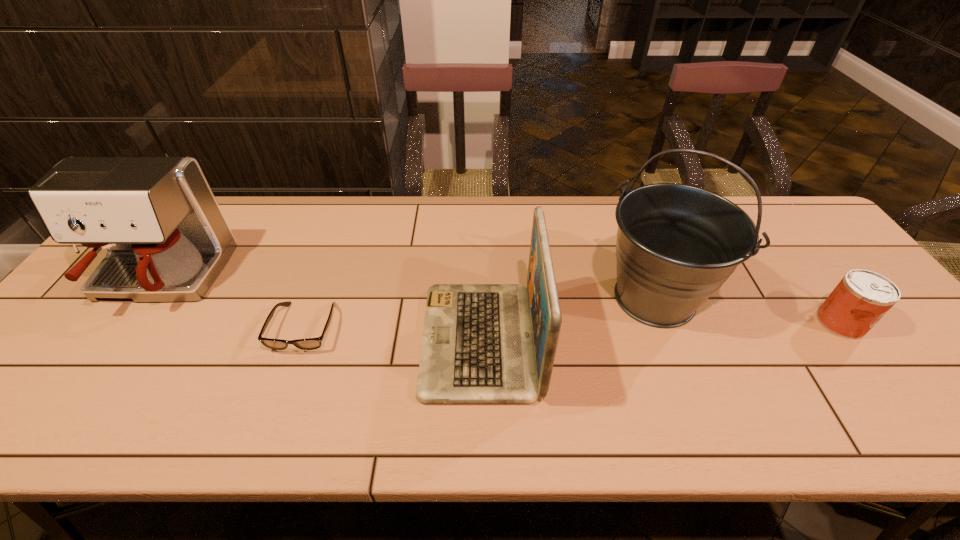
Where is `vacant space at the left edge of the desktop`? The height and width of the screenshot is (540, 960). vacant space at the left edge of the desktop is located at coordinates (84, 330).

Image resolution: width=960 pixels, height=540 pixels. I want to click on vacant space at the right edge of the desktop, so click(824, 251).

You are a GUI agent. You are given a task and a screenshot of the screen. Output one action in this format:
    pyautogui.click(x=<x>, y=<y>)
    Task: Click on the free space at the far right corner of the desktop
    This screenshot has width=960, height=540.
    Given the screenshot: What is the action you would take?
    pyautogui.click(x=756, y=198)

Identify the location of empty space that is in between the tallest object and the leftmost object. This screenshot has width=960, height=540. (407, 288).

Locate an element on the screen. The height and width of the screenshot is (540, 960). vacant region between the tallest object and the leftmost object is located at coordinates (407, 288).

Find the location of a particular element. The height and width of the screenshot is (540, 960). empty space that is in between the second object from left to right and the second shortest object is located at coordinates (572, 325).

In order to click on free space between the third object from right to left and the can in this screenshot , I will do `click(660, 331)`.

In order to click on empty space between the laptop computer and the tallest object in this screenshot , I will do pyautogui.click(x=568, y=319).

The width and height of the screenshot is (960, 540). I want to click on free area in between the tallest object and the coffee maker, so click(x=407, y=288).

Image resolution: width=960 pixels, height=540 pixels. What are the coordinates of `free space between the third object from left to right and the bucket` in the screenshot? It's located at (568, 319).